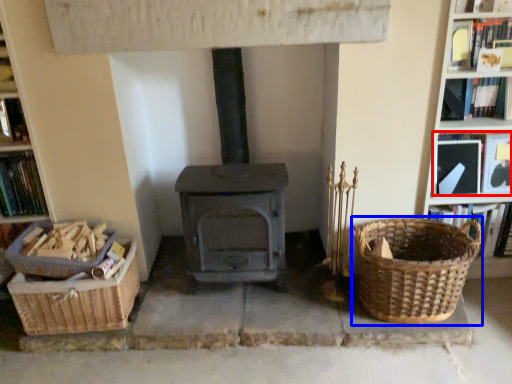
Question: Among these objects, which one is farthest to the camera, book (highlighted by a red box) or basket (highlighted by a blue box)?

Choices:
 (A) book
 (B) basket

Answer: (A)